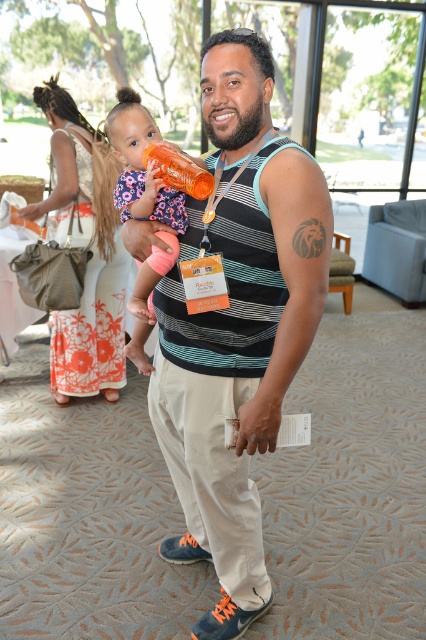
Based on the photo, between striped tank top at center and orange translucent bottle at center, which one has more height?

striped tank top at center

Between striped tank top at center and orange translucent bottle at center, which one has less height?

orange translucent bottle at center

What do you see at coordinates (238, 324) in the screenshot? The image size is (426, 640). I see `striped tank top at center` at bounding box center [238, 324].

At what (x,y) coordinates should I click in order to perform the action: click on striped tank top at center. Please return your answer as a coordinate pair (x, y). Looking at the image, I should click on (238, 324).

Which is below, floral fabric dress at center or orange plastic bottle at center?

Positioned lower is floral fabric dress at center.

Who is more forward, (66, 387) or (123, 129)?

Positioned in front is point (123, 129).

What are the coordinates of `floral fabric dress at center` in the screenshot? It's located at (92, 250).

Can you confirm if striped tank top at center is taller than orange plastic bottle at center?

Correct, striped tank top at center is much taller as orange plastic bottle at center.

Where is `striped tank top at center`? This screenshot has width=426, height=640. striped tank top at center is located at coordinates [238, 324].

What are the coordinates of `striped tank top at center` in the screenshot? It's located at (238, 324).